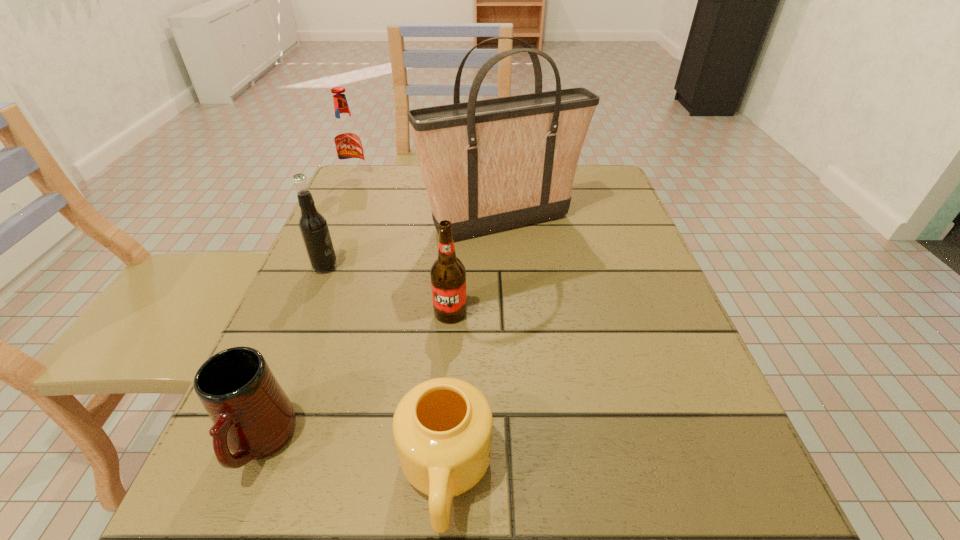
You are a GUI agent. You are given a task and a screenshot of the screen. Output one action in this format:
    pyautogui.click(x=<x>, y=<y>)
    Task: Click on the blank space at the far edge of the desktop
    
    Given the screenshot: What is the action you would take?
    pyautogui.click(x=421, y=211)

In the image, there is a desktop. Where is `vacant area at the left edge`? vacant area at the left edge is located at coordinates point(297,472).

In the image, there is a desktop. In order to click on vacant space at the right edge in this screenshot , I will do `click(607, 221)`.

Identify the location of vacant space at the far left corner of the desktop. (384, 187).

You are a GUI agent. You are given a task and a screenshot of the screen. Output one action in this format:
    pyautogui.click(x=<x>, y=<y>)
    Task: Click on the vacant region at the far right corner
    The image size is (960, 540).
    Given the screenshot: What is the action you would take?
    pyautogui.click(x=596, y=187)

I want to click on vacant area that lies between the second nearest root beer and the farthest root beer, so click(x=341, y=224).

Locate an element on the screen. This screenshot has height=540, width=960. free space between the tallest object and the farthest root beer is located at coordinates (429, 201).

At what (x,y) coordinates should I click in order to perform the action: click on vacant area that lies between the shopping bag and the farthest root beer. Please return your answer as a coordinate pair (x, y). This screenshot has height=540, width=960. Looking at the image, I should click on tap(429, 201).

I want to click on blank region between the third farthest object and the farthest object, so click(341, 224).

This screenshot has height=540, width=960. I want to click on object that ranks as the fourth closest to the farthest object, so click(x=253, y=418).